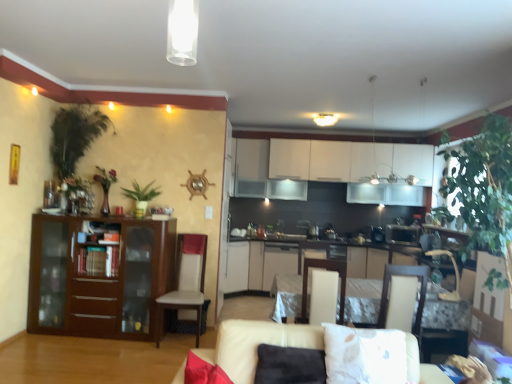
Question: Is beige fabric couch at lower center bigger or smaller than white fabric armchair at center, the second armchair from the right?

Choices:
 (A) small
 (B) big

Answer: (B)

Question: From the image's perspective, is beige fabric couch at lower center located above or below white fabric armchair at center, the second armchair from the right?

Choices:
 (A) above
 (B) below

Answer: (B)

Question: Which object is the farthest from the white soft pillow at lower center?

Choices:
 (A) matte white cabinet at center, positioned as the 2th cabinetry in left-to-right order
 (B) beige fabric couch at lower center
 (C) green matte plant at center-left, acting as the second plant starting from the left
 (D) white leather chair at left
 (E) white matte cabinets at upper center, the first cabinetry when ordered from right to left

Answer: (E)

Question: Which of these objects is positioned farthest from the white matte cabinets at upper center, the 2th cabinetry positioned from the front?

Choices:
 (A) white cardboard box at lower right
 (B) white leather chair at left
 (C) matte wood cabinet at left, the third cabinetry positioned from the back
 (D) matte white cabinet at center, arranged as the 3th cabinetry when viewed from the front
 (E) green leafy plant at left, placed as the first plant when sorted from left to right

Answer: (A)